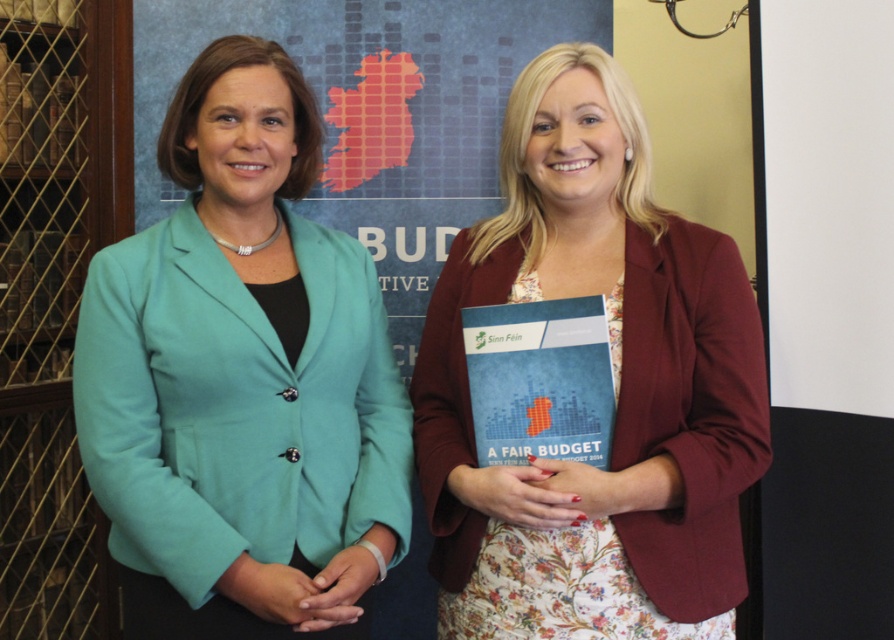
Question: Which point appears farthest from the camera in this image?

Choices:
 (A) (644, 566)
 (B) (533, 452)

Answer: (A)

Question: Is teal fabric jacket at center closer to the viewer compared to maroon textured blazer at center?

Choices:
 (A) yes
 (B) no

Answer: (A)

Question: Which point appears farthest from the camera in this image?

Choices:
 (A) (117, 292)
 (B) (588, 109)
 (C) (493, 310)

Answer: (B)

Question: Which of the following is the closest to the observer?

Choices:
 (A) blue paper book at center
 (B) maroon textured blazer at center
 (C) teal fabric jacket at center

Answer: (C)

Question: Does teal fabric jacket at center appear on the right side of maroon textured blazer at center?

Choices:
 (A) yes
 (B) no

Answer: (B)

Question: Can you confirm if teal fabric jacket at center is positioned below blue paper book at center?

Choices:
 (A) no
 (B) yes

Answer: (A)